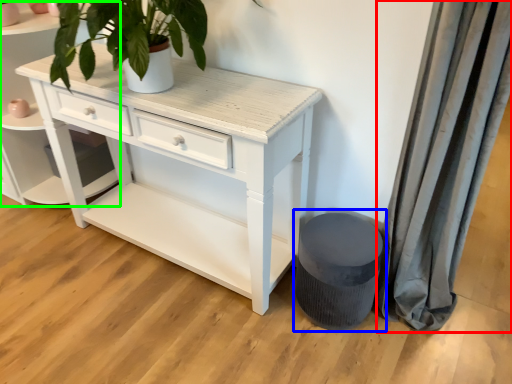
Question: Which object is the closest to the curtain (highlighted by a red box)? Choose among these: music stool (highlighted by a blue box) or shelf (highlighted by a green box).

Choices:
 (A) music stool
 (B) shelf

Answer: (A)